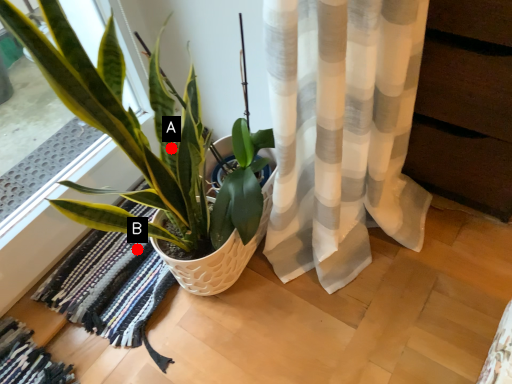
Question: Two points are circled on the image, labeled by A and B beside each circle. Which of the following is the closest to the observer?

Choices:
 (A) A is closer
 (B) B is closer

Answer: (A)